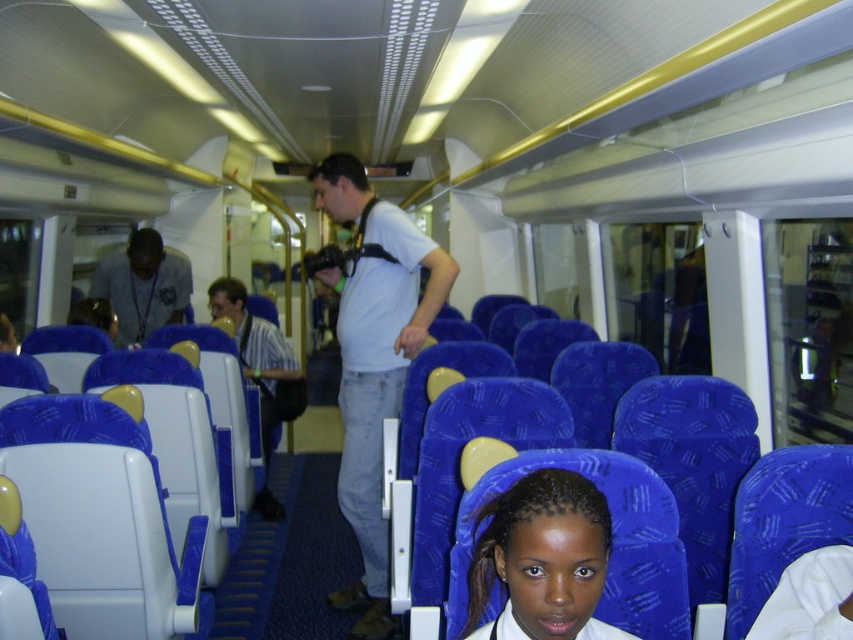
Can you confirm if white matte shirt at center is positioned below smooth skin face at center?

Incorrect, white matte shirt at center is not positioned below smooth skin face at center.

Who is positioned more to the right, white matte shirt at center or smooth skin face at center?

Positioned to the right is smooth skin face at center.

Measure the distance between white matte shirt at center and camera.

white matte shirt at center is 2.90 meters from camera.

The width and height of the screenshot is (853, 640). Find the location of `white matte shirt at center`. white matte shirt at center is located at coordinates (374, 356).

Is smooth skin face at center above matte gray shirt at left?

Incorrect, smooth skin face at center is not positioned above matte gray shirt at left.

Is point (595, 579) farther from viewer compared to point (173, 301)?

No.

I want to click on smooth skin face at center, so click(x=543, y=560).

Is point (380, 396) farther from camera compared to point (111, 273)?

No, it is not.

Can you confirm if white matte shirt at center is positioned to the left of matte gray shirt at left?

In fact, white matte shirt at center is to the right of matte gray shirt at left.

Describe the element at coordinates (374, 356) in the screenshot. I see `white matte shirt at center` at that location.

In order to click on white matte shirt at center in this screenshot , I will do `click(374, 356)`.